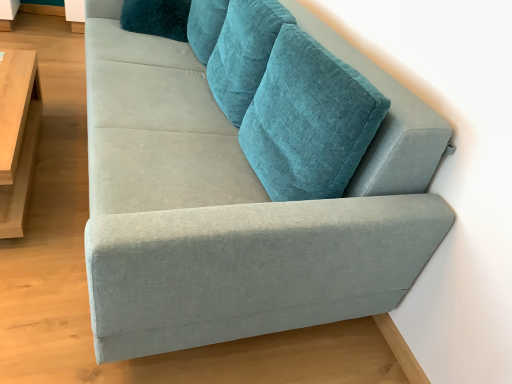
This screenshot has height=384, width=512. What do you see at coordinates (17, 135) in the screenshot? I see `light wood/wooden table at left` at bounding box center [17, 135].

I want to click on velvet teal couch at upper right, so click(236, 206).

Which is behind, teal velvet pillow at upper center or light wood/wooden table at left?

teal velvet pillow at upper center is further away from the camera.

Considering the positions of objects teal velvet pillow at upper center and light wood/wooden table at left in the image provided, who is more to the right, teal velvet pillow at upper center or light wood/wooden table at left?

Positioned to the right is teal velvet pillow at upper center.

Measure the distance between teal velvet pillow at upper center and light wood/wooden table at left.

The distance of teal velvet pillow at upper center from light wood/wooden table at left is 34.86 inches.

Would you say teal velvet pillow at upper center is outside light wood/wooden table at left?

Indeed, teal velvet pillow at upper center is completely outside light wood/wooden table at left.

The image size is (512, 384). I want to click on pillow behind the velvet teal couch at upper right, so click(156, 18).

Is velvet teal couch at upper right surrounded by teal velvet pillow at upper center?

Definitely not — velvet teal couch at upper right is not inside teal velvet pillow at upper center.

From a real-world perspective, between teal velvet pillow at upper center and velvet teal couch at upper right, who is vertically higher?

In real-world perspective, teal velvet pillow at upper center is above.

Can you confirm if light wood/wooden table at left is wider than teal velvet pillow at upper center?

No, light wood/wooden table at left is not wider than teal velvet pillow at upper center.

Is light wood/wooden table at left not close to teal velvet pillow at upper center?

Actually, light wood/wooden table at left and teal velvet pillow at upper center are a little close together.

From a real-world perspective, who is located lower, light wood/wooden table at left or teal velvet pillow at upper center?

In real-world perspective, light wood/wooden table at left is lower.

Considering the positions of objects light wood/wooden table at left and velvet teal couch at upper right in the image provided, who is more to the right, light wood/wooden table at left or velvet teal couch at upper right?

From the viewer's perspective, velvet teal couch at upper right appears more on the right side.

From the picture: Which of these two, light wood/wooden table at left or velvet teal couch at upper right, stands taller?

With more height is velvet teal couch at upper right.

Is light wood/wooden table at left positioned with its back to velvet teal couch at upper right?

Yes, light wood/wooden table at left is positioned with its back facing velvet teal couch at upper right.

Based on the photo, which point is more forward, (132, 283) or (30, 101)?

The point (132, 283) is in front.

Are velvet teal couch at upper right and light wood/wooden table at left making contact?

No, velvet teal couch at upper right is not next to light wood/wooden table at left.

From a real-world perspective, between velvet teal couch at upper right and light wood/wooden table at left, who is vertically lower?

light wood/wooden table at left is physically lower.

This screenshot has height=384, width=512. Find the location of `studio couch that appears above the light wood/wooden table at left (from the image's perspective)`. studio couch that appears above the light wood/wooden table at left (from the image's perspective) is located at coordinates (236, 206).

Is point (413, 107) positioned after point (172, 31)?

That is False.

Is teal velvet pillow at upper center located within velvet teal couch at upper right?

Yes, velvet teal couch at upper right is surrounding teal velvet pillow at upper center.

Which of these two, velvet teal couch at upper right or teal velvet pillow at upper center, stands taller?

velvet teal couch at upper right is taller.

Is the depth of velvet teal couch at upper right greater than that of teal velvet pillow at upper center?

No, velvet teal couch at upper right is closer to the viewer.

The image size is (512, 384). In order to click on pillow that appears behind the light wood/wooden table at left in this screenshot , I will do `click(156, 18)`.

What are the coordinates of `pillow that appears above the velvet teal couch at upper right (from a real-world perspective)` in the screenshot? It's located at (156, 18).

Considering their positions, is velvet teal couch at upper right positioned closer to teal velvet pillow at upper center than light wood/wooden table at left?

Based on the image, light wood/wooden table at left appears to be nearer to teal velvet pillow at upper center.

From the image, which object appears to be farther from velvet teal couch at upper right, light wood/wooden table at left or teal velvet pillow at upper center?

teal velvet pillow at upper center is positioned further to the anchor velvet teal couch at upper right.

From the image, which object appears to be farther from light wood/wooden table at left, velvet teal couch at upper right or teal velvet pillow at upper center?

The object further to light wood/wooden table at left is velvet teal couch at upper right.

Looking at the image, which one is located further to velvet teal couch at upper right, teal velvet pillow at upper center or light wood/wooden table at left?

teal velvet pillow at upper center is further to velvet teal couch at upper right.

Based on their spatial positions, is teal velvet pillow at upper center or velvet teal couch at upper right closer to light wood/wooden table at left?

teal velvet pillow at upper center is positioned closer to the anchor light wood/wooden table at left.

Looking at the image, which one is located further to teal velvet pillow at upper center, light wood/wooden table at left or velvet teal couch at upper right?

Among the two, velvet teal couch at upper right is located further to teal velvet pillow at upper center.

You are a GUI agent. You are given a task and a screenshot of the screen. Output one action in this format:
    pyautogui.click(x=<x>, y=<y>)
    Task: Click on the table between velvet teal couch at upper right and teal velvet pillow at upper center along the z-axis
    This screenshot has width=512, height=384.
    Given the screenshot: What is the action you would take?
    pyautogui.click(x=17, y=135)